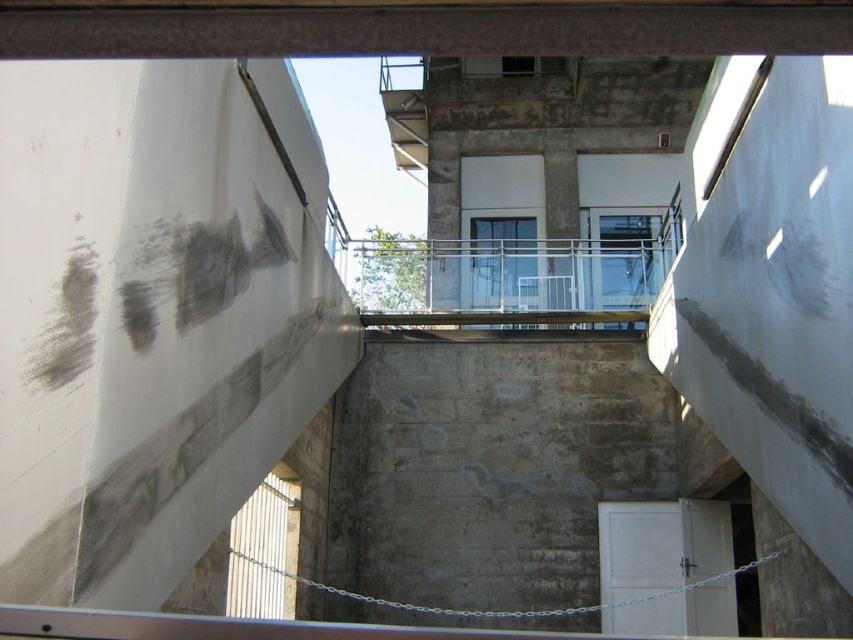
Does gray concrete wall at center have a greater width compared to clear glass balcony at center?

Indeed, gray concrete wall at center has a greater width compared to clear glass balcony at center.

Describe the element at coordinates (491, 465) in the screenshot. I see `gray concrete wall at center` at that location.

Where is `gray concrete wall at center`? The height and width of the screenshot is (640, 853). gray concrete wall at center is located at coordinates (491, 465).